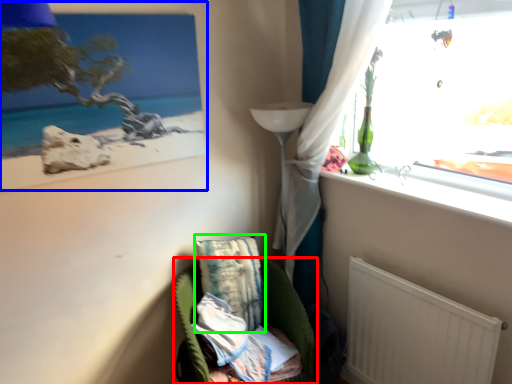
Question: Which object is positioned closest to furniture (highlighted by a red box)? Select from picture frame (highlighted by a blue box) and pillow (highlighted by a green box).

Choices:
 (A) picture frame
 (B) pillow

Answer: (B)